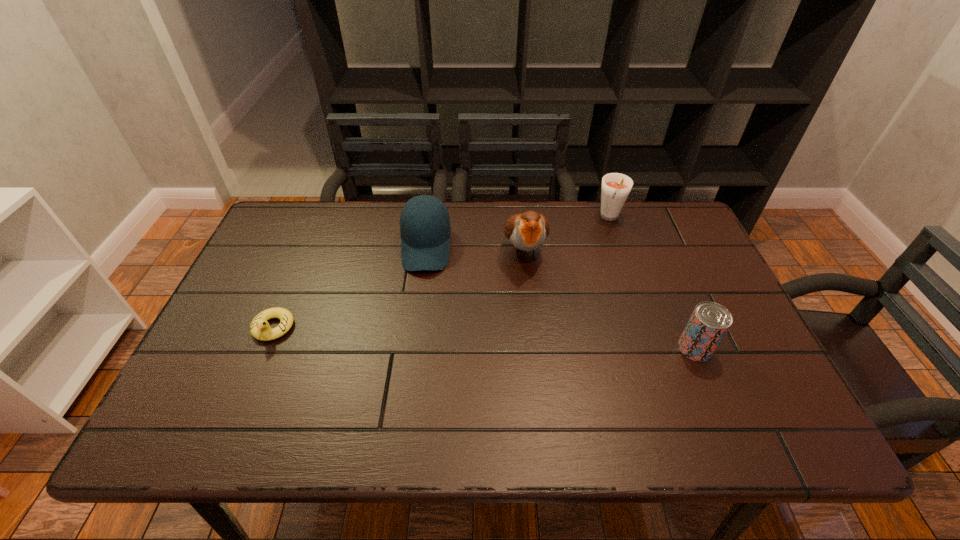
Where is `vacant space on the desktop that is between the shortest object and the rightmost object and is positioned at the face of the third object from left to right`? This screenshot has width=960, height=540. vacant space on the desktop that is between the shortest object and the rightmost object and is positioned at the face of the third object from left to right is located at coordinates (539, 341).

You are a GUI agent. You are given a task and a screenshot of the screen. Output one action in this format:
    pyautogui.click(x=<x>, y=<y>)
    Task: Click on the vacant space on the desktop that is between the leftmost object and the beer can and is positioned on the drink side of the root beer
    This screenshot has height=540, width=960.
    Given the screenshot: What is the action you would take?
    pyautogui.click(x=540, y=341)

Find the location of a particular element. This screenshot has height=540, width=960. vacant spot on the desktop that is between the leftmost object and the beer can and is positioned on the front-facing side of the baseball cap is located at coordinates (420, 335).